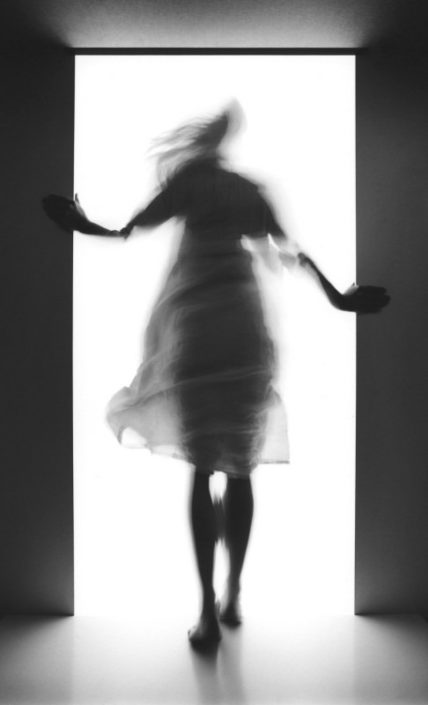
This screenshot has height=705, width=428. Find the location of `ceiling`. ceiling is located at coordinates (163, 41).